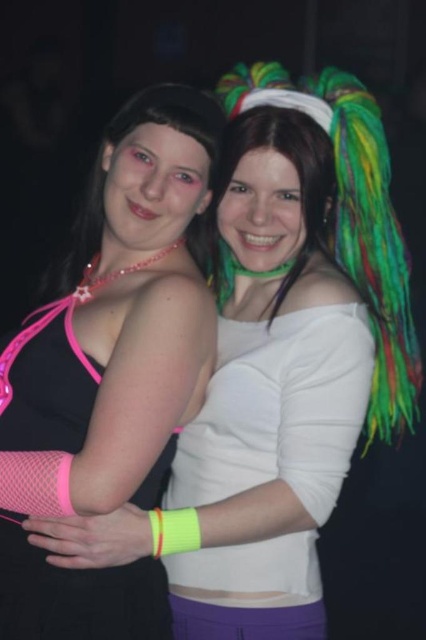
You are at a party and need to find the person wearing the matte white shirt at center. Which direction should you look relative to the person in the matte black tank top at center?

The matte white shirt at center is to the right of the matte black tank top at center, so you should look to the right of the person in the matte black tank top at center to find the matte white shirt at center.

You are organizing a charity event and need to ensure that all donated clothing items fit properly. You have two shirts to check, the matte black tank top at center and the matte white shirt at center. Which one has a larger size?

The matte black tank top at center is bigger than the matte white shirt at center, so the matte black tank top at center has a larger size.